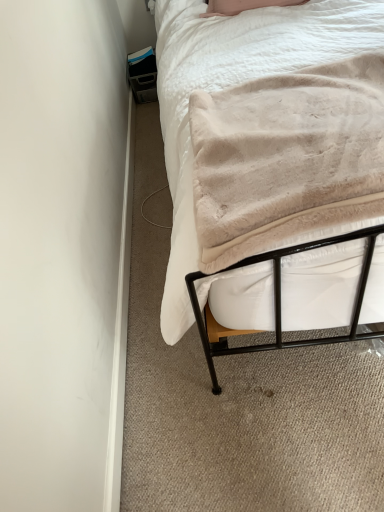
Question: From the image's perspective, is beige plush blanket at upper right under beige plush blanket at center?

Choices:
 (A) yes
 (B) no

Answer: (B)

Question: Does beige plush blanket at upper right have a smaller size compared to beige plush blanket at center?

Choices:
 (A) no
 (B) yes

Answer: (A)

Question: Considering the relative sizes of beige plush blanket at upper right and beige plush blanket at center in the image provided, is beige plush blanket at upper right thinner than beige plush blanket at center?

Choices:
 (A) no
 (B) yes

Answer: (A)

Question: Are beige plush blanket at upper right and beige plush blanket at center beside each other?

Choices:
 (A) no
 (B) yes

Answer: (B)

Question: Considering the relative positions of beige plush blanket at upper right and beige plush blanket at center in the image provided, is beige plush blanket at upper right in front of beige plush blanket at center?

Choices:
 (A) yes
 (B) no

Answer: (B)

Question: Is beige plush blanket at upper right to the right of beige plush blanket at center from the viewer's perspective?

Choices:
 (A) yes
 (B) no

Answer: (B)

Question: Considering the relative sizes of beige plush blanket at center and beige plush blanket at upper right in the image provided, is beige plush blanket at center shorter than beige plush blanket at upper right?

Choices:
 (A) yes
 (B) no

Answer: (B)

Question: Does beige plush blanket at center have a greater width compared to beige plush blanket at upper right?

Choices:
 (A) yes
 (B) no

Answer: (B)

Question: Is beige plush blanket at center bigger than beige plush blanket at upper right?

Choices:
 (A) no
 (B) yes

Answer: (A)

Question: Can you confirm if beige plush blanket at center is positioned to the left of beige plush blanket at upper right?

Choices:
 (A) no
 (B) yes

Answer: (A)

Question: From the image's perspective, is beige plush blanket at center located beneath beige plush blanket at upper right?

Choices:
 (A) no
 (B) yes

Answer: (B)

Question: Are beige plush blanket at center and beige plush blanket at upper right located far from each other?

Choices:
 (A) yes
 (B) no

Answer: (B)

Question: Based on their sizes in the image, would you say beige plush blanket at center is bigger or smaller than beige plush blanket at upper right?

Choices:
 (A) big
 (B) small

Answer: (B)